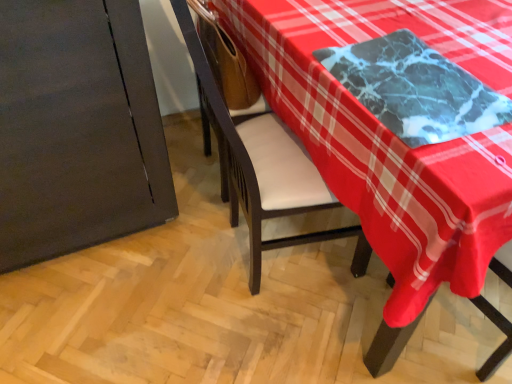
Where is `vacant area that lies in front of wooden armchair at center`? The width and height of the screenshot is (512, 384). vacant area that lies in front of wooden armchair at center is located at coordinates (201, 242).